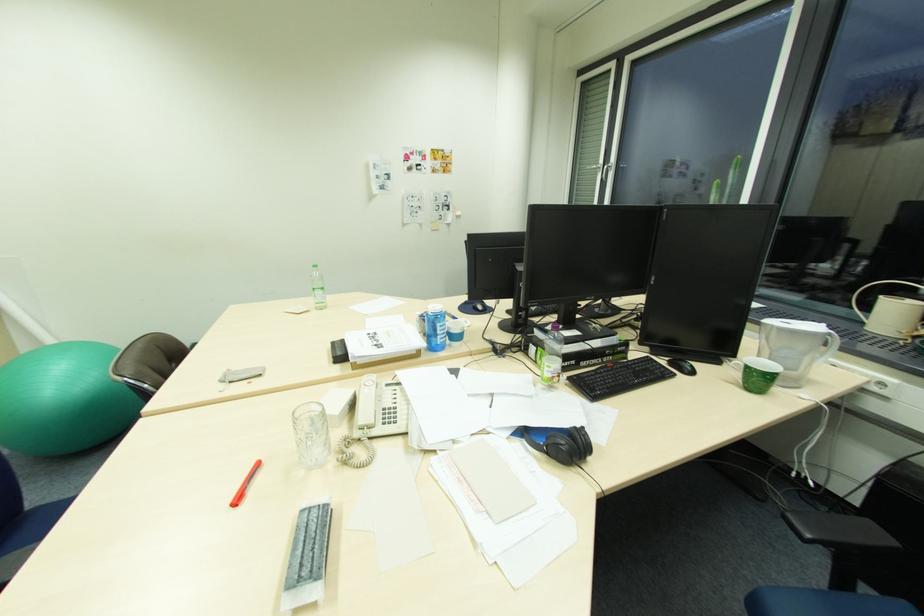
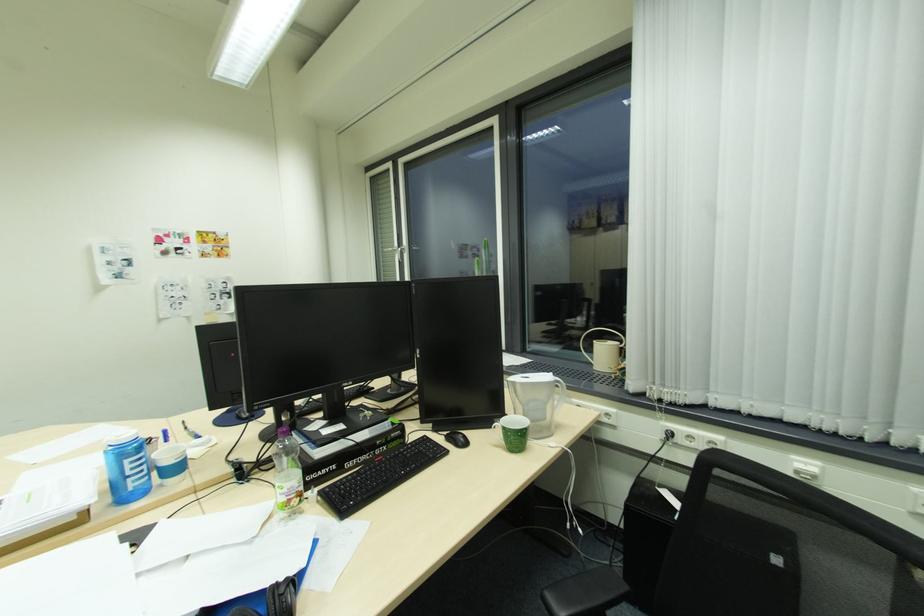
Where in the second image is the point corresponding to the point at 834,334 from the first image?

(563, 382)